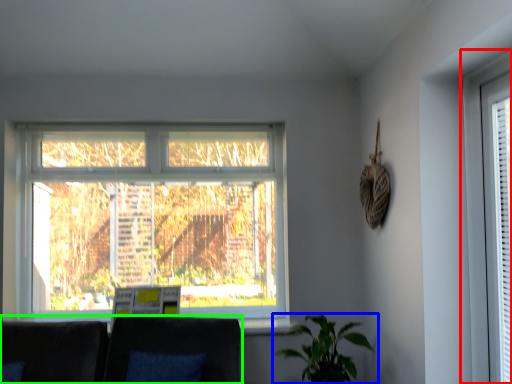
Question: Considering the real-world distances, which object is farthest from window (highlighted by a red box)? houseplant (highlighted by a blue box) or couch (highlighted by a green box)?

Choices:
 (A) houseplant
 (B) couch

Answer: (B)